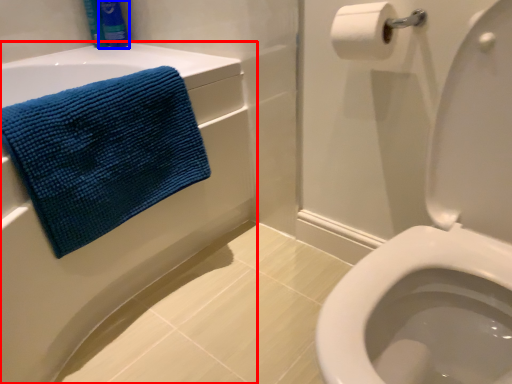
Question: Which object appears farthest to the camera in this image, bath (highlighted by a red box) or toiletry (highlighted by a blue box)?

Choices:
 (A) bath
 (B) toiletry

Answer: (B)